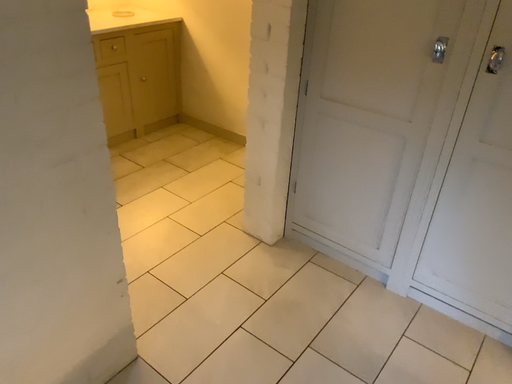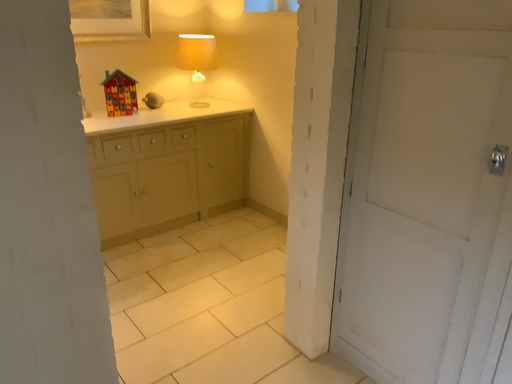
Question: How did the camera likely rotate when shooting the video?

Choices:
 (A) rotated upward
 (B) rotated downward

Answer: (A)